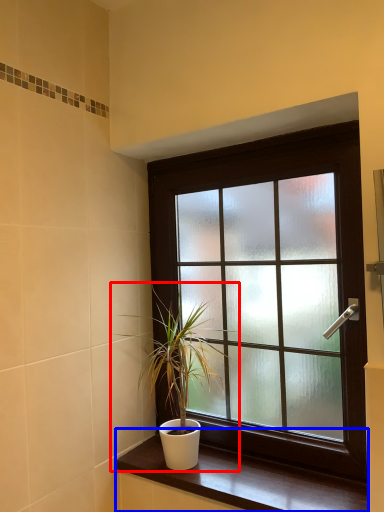
Question: Which of the following is the farthest to the observer, houseplant (highlighted by a red box) or window sill (highlighted by a blue box)?

Choices:
 (A) houseplant
 (B) window sill

Answer: (A)